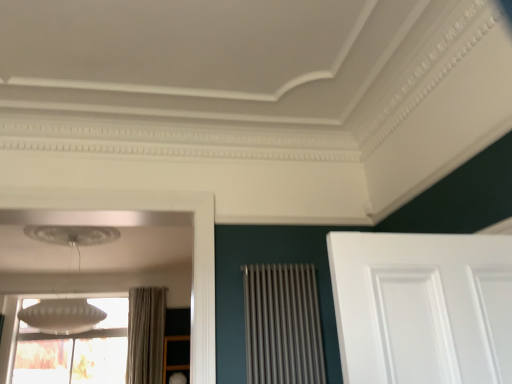
Question: Would you say white frosted glass window at lower left is inside or outside matte gray curtain at left?

Choices:
 (A) outside
 (B) inside

Answer: (A)

Question: Considering the positions of white frosted glass window at lower left and matte gray curtain at left in the image, is white frosted glass window at lower left taller or shorter than matte gray curtain at left?

Choices:
 (A) short
 (B) tall

Answer: (A)

Question: Estimate the real-world distances between objects in this image. Which object is farther from the white frosted glass window at lower left?

Choices:
 (A) metallic silver radiator at center
 (B) matte gray curtain at left
 (C) white frosted glass lampshade at upper left
 (D) wooden shelf at lower left

Answer: (A)

Question: Which object is positioned closest to the white frosted glass lampshade at upper left?

Choices:
 (A) white frosted glass window at lower left
 (B) matte gray curtain at left
 (C) metallic silver radiator at center
 (D) wooden shelf at lower left

Answer: (A)